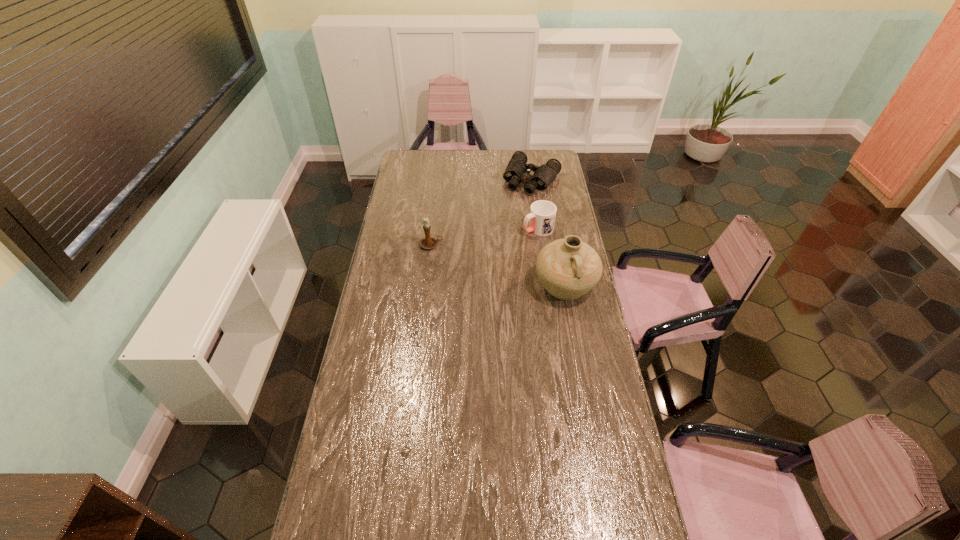
You are a GUI agent. You are given a task and a screenshot of the screen. Output one action in this format:
    pyautogui.click(x=<x>, y=<y>)
    Task: Click on the free spot located through the eyepieces of the binoculars
    
    Given the screenshot: What is the action you would take?
    pyautogui.click(x=517, y=202)

Where is `vacant space positioned 0.100m through the eyepieces of the binoculars`? Image resolution: width=960 pixels, height=540 pixels. vacant space positioned 0.100m through the eyepieces of the binoculars is located at coordinates (516, 206).

Find the location of a particular element. This screenshot has width=960, height=540. vacant space located 0.090m through the eyepieces of the binoculars is located at coordinates (516, 205).

Find the location of `vacant region located 0.050m on the side of the second shortest object with the handle`. vacant region located 0.050m on the side of the second shortest object with the handle is located at coordinates (x=516, y=238).

Locate an element on the screen. The height and width of the screenshot is (540, 960). vacant space located 0.200m on the side of the second shortest object with the handle is located at coordinates (492, 249).

Locate an element on the screen. The width and height of the screenshot is (960, 540). vacant space located 0.180m on the side of the second shortest object with the handle is located at coordinates (495, 248).

What are the coordinates of `object that is positioned at the far edge` in the screenshot? It's located at (517, 171).

The width and height of the screenshot is (960, 540). I want to click on pottery at the right edge, so click(x=568, y=268).

I want to click on binoculars located in the right edge section of the desktop, so click(x=517, y=171).

You are a GUI agent. You are given a task and a screenshot of the screen. Output one action in this format:
    pyautogui.click(x=<x>, y=<y>)
    Task: Click on the mug that is positioned at the right edge
    Image resolution: width=960 pixels, height=540 pixels.
    Given the screenshot: What is the action you would take?
    pyautogui.click(x=542, y=215)